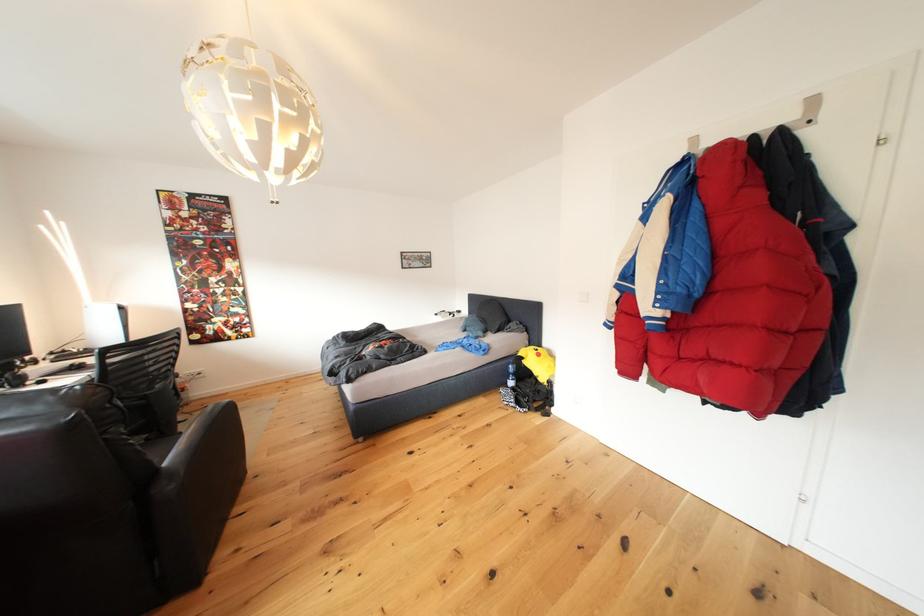
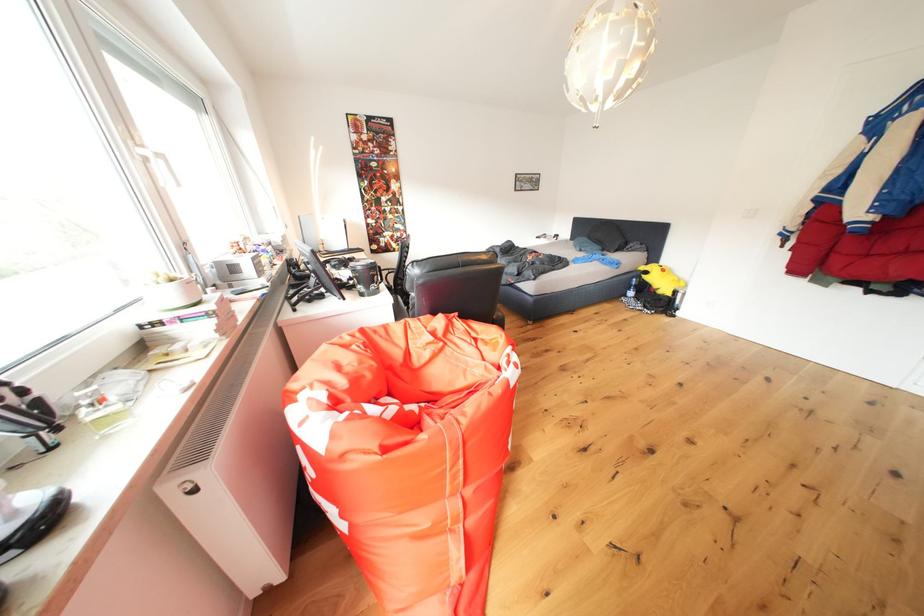
The point at (532, 367) is marked in the first image. Where is the corresponding point in the second image?

(653, 282)